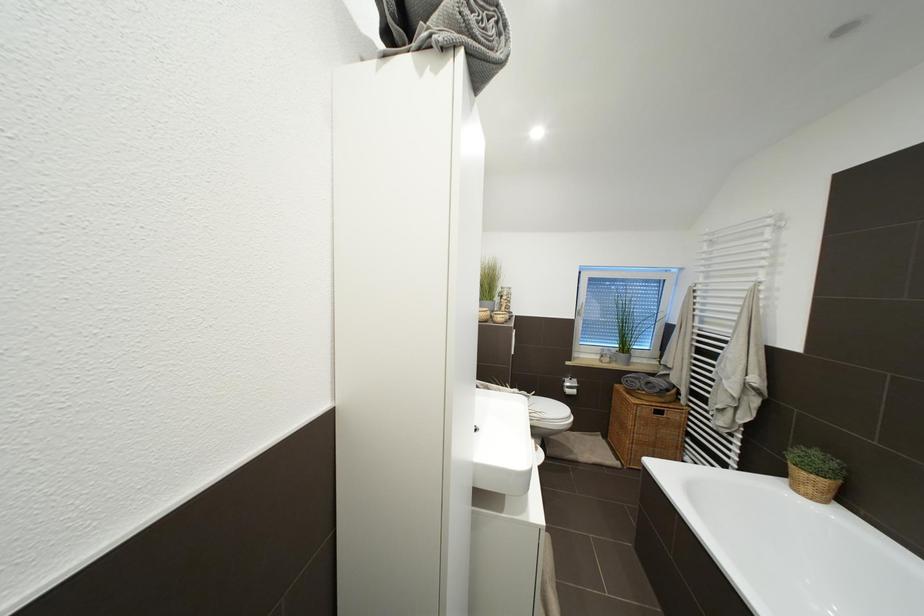
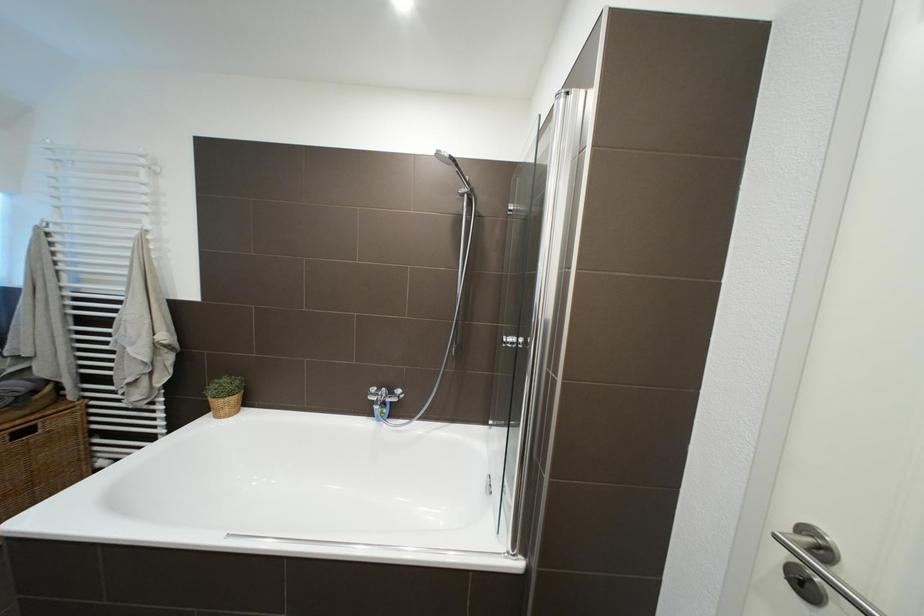
Question: The images are taken continuously from a first-person perspective. In which direction is your viewpoint rotating?

Choices:
 (A) Left
 (B) Right
 (C) Up
 (D) Down

Answer: (B)